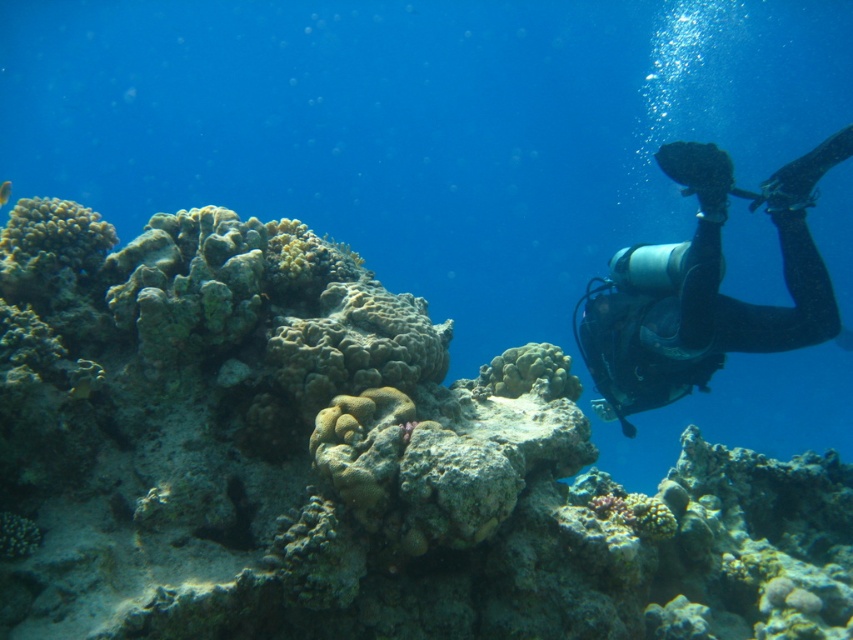
You are an underwater photographer aiming to capture both the green textured coral reef at center and the shiny blue fish at upper left in a single shot. Based on their sizes, which object should you focus on first to ensure both are in frame?

The green textured coral reef at center is taller than the shiny blue fish at upper left, so you should focus on the green textured coral reef at center first to ensure both are in frame.

You are a marine biologist observing the underwater scene. You need to collect samples from both the green textured coral reef at center and the shiny blue fish at upper left. Given that your sampling tool has a maximum reach of 8 feet, can you collect both samples without moving closer?

The green textured coral reef at center and the shiny blue fish at upper left are 8.70 feet apart from each other. Since the sampling tool has a maximum reach of 8 feet, you cannot collect both samples without moving closer because the distance between them exceeds the tool reach.